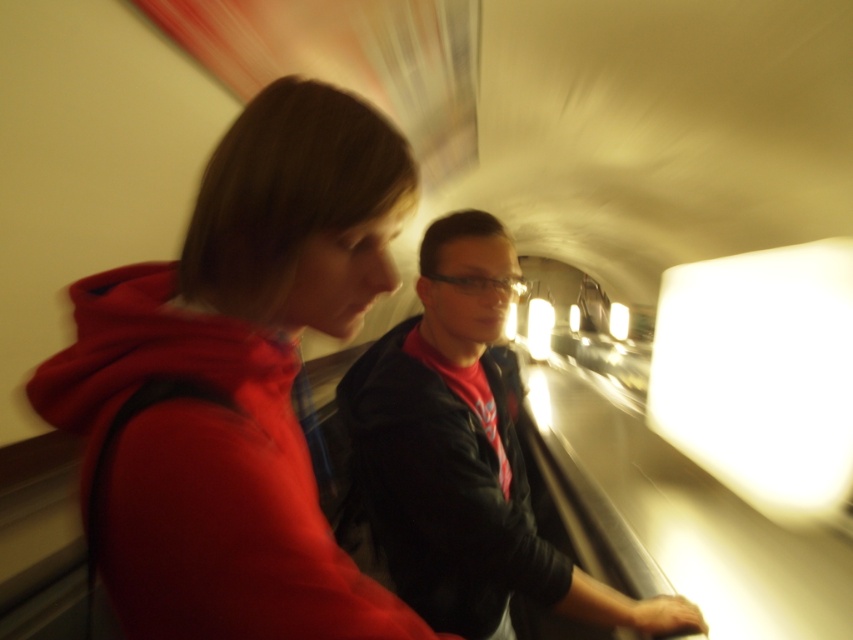
Question: Can you confirm if matte red hoodie at left is thinner than matte black jacket at center?

Choices:
 (A) yes
 (B) no

Answer: (A)

Question: Can you confirm if matte red hoodie at left is wider than matte black jacket at center?

Choices:
 (A) no
 (B) yes

Answer: (A)

Question: Can you confirm if matte red hoodie at left is positioned above matte black jacket at center?

Choices:
 (A) no
 (B) yes

Answer: (B)

Question: Which point is closer to the camera?

Choices:
 (A) matte red hoodie at left
 (B) matte black jacket at center

Answer: (A)

Question: Which point is farther to the camera?

Choices:
 (A) (495, 336)
 (B) (244, 566)

Answer: (A)

Question: Which point is farther from the camera taking this photo?

Choices:
 (A) (456, 234)
 (B) (149, 424)

Answer: (A)